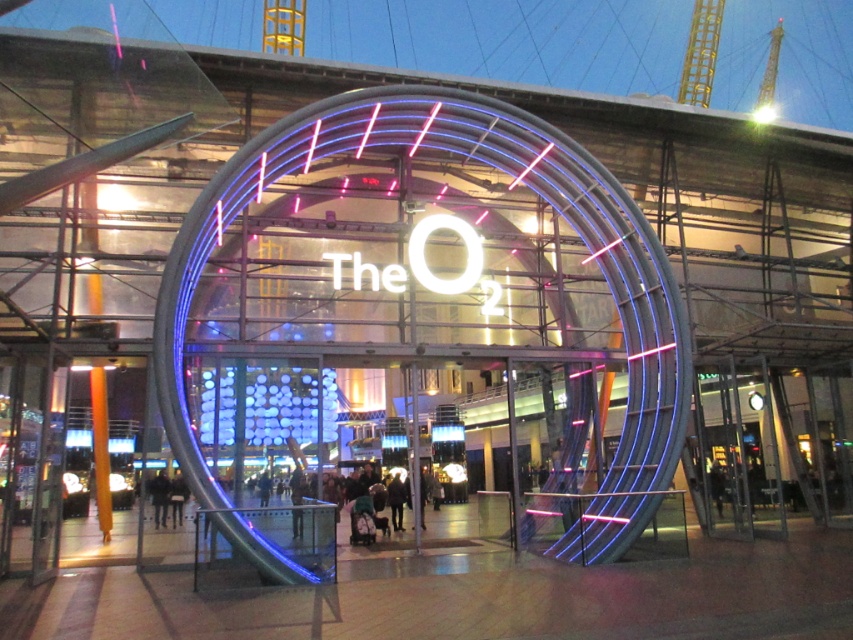
Who is shorter, neon blue glass at center or dark brown leather coat at center?

With less height is dark brown leather coat at center.

Where is `neon blue glass at center`? The width and height of the screenshot is (853, 640). neon blue glass at center is located at coordinates (508, 188).

Measure the distance between neon blue glass at center and camera.

neon blue glass at center is 28.68 meters from camera.

Identify the location of neon blue glass at center. The image size is (853, 640). (508, 188).